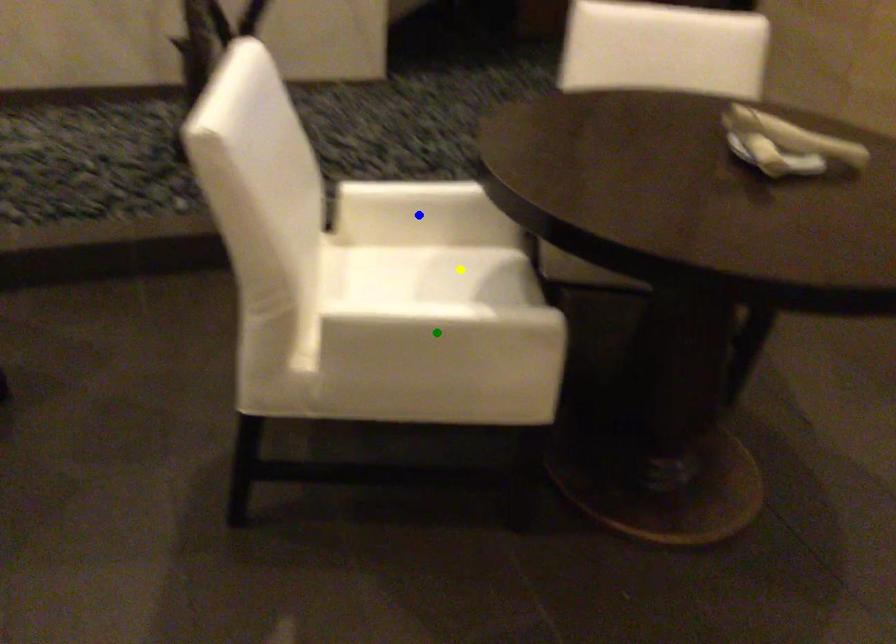
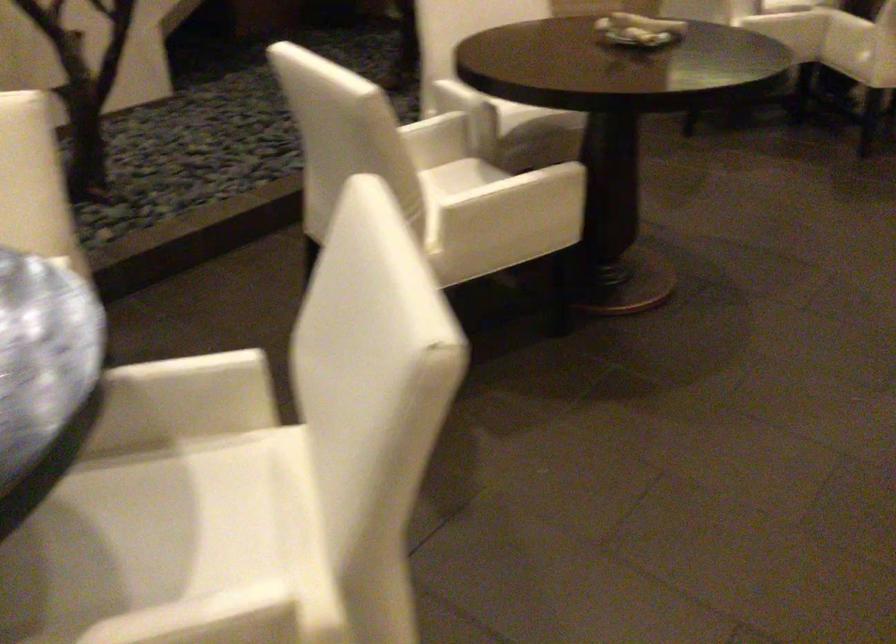
I am providing you with two images of the same scene from different viewpoints. Three points are marked in image1. Which point corresponds to a part or object that is occluded in image2?In image1, three points are marked. Which of them correspond to a part or object that is occluded in image2?Among the three points shown in image1, which one corresponds to a part or object that is no longer visible due to occlusion in image2?

blue point cannot be seen in image2.